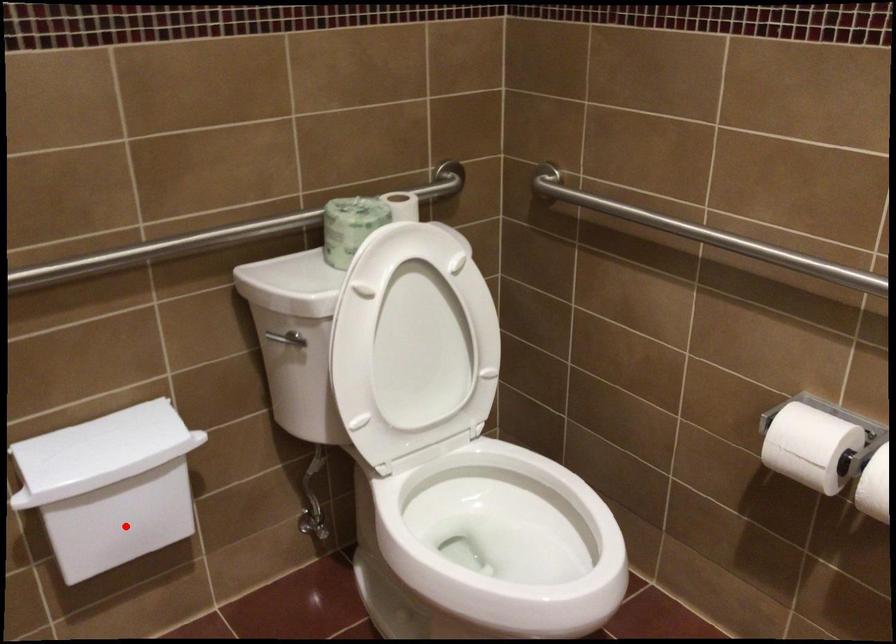
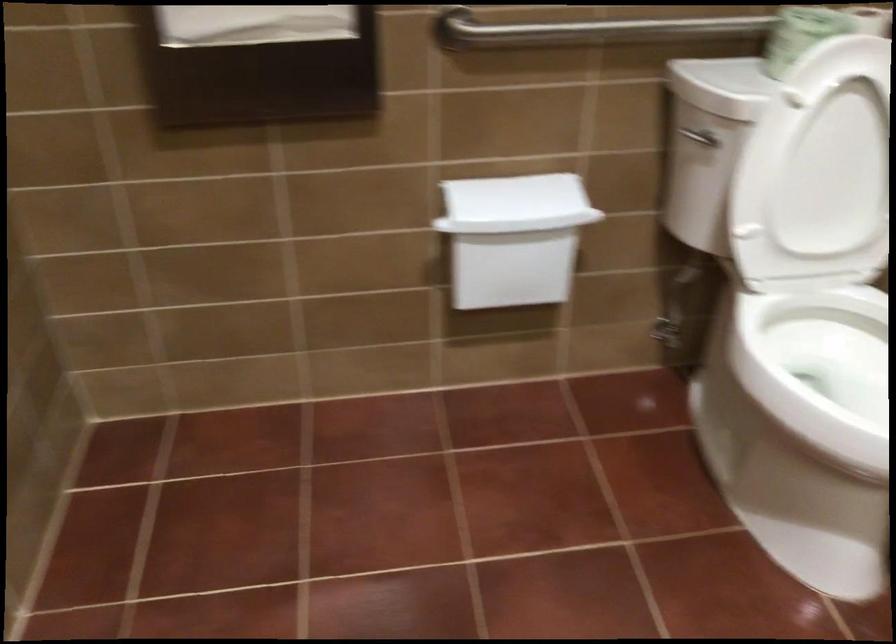
The point at the highlighted location is marked in the first image. Where is the corresponding point in the second image?

(512, 269)